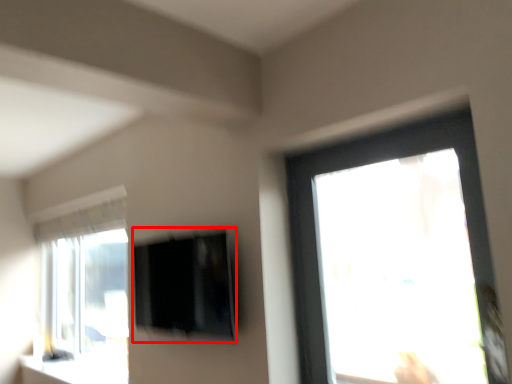
Question: From the image's perspective, where is window screen (annotated by the red box) located relative to window sill?

Choices:
 (A) above
 (B) below

Answer: (A)